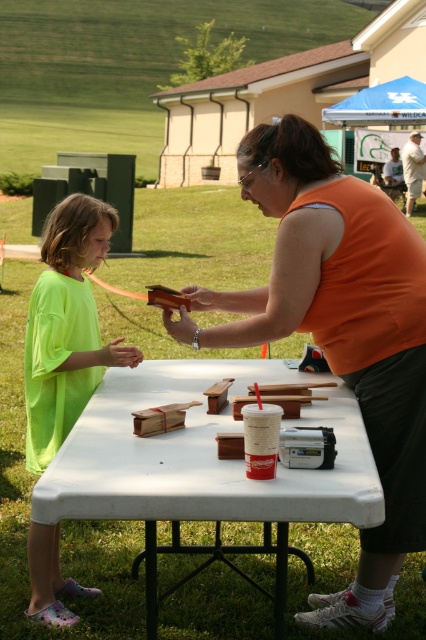
Question: Does white plastic table at center have a smaller size compared to neon green t-shirt at left?

Choices:
 (A) no
 (B) yes

Answer: (A)

Question: Can you confirm if orange fabric shirt at center is thinner than white plastic table at center?

Choices:
 (A) no
 (B) yes

Answer: (B)

Question: Which point is farther to the camera?

Choices:
 (A) orange fabric shirt at center
 (B) white plastic table at center
 (C) neon green t-shirt at left

Answer: (C)

Question: Which point is farther to the camera?

Choices:
 (A) (x=345, y=298)
 (B) (x=57, y=502)

Answer: (A)

Question: Which point is closer to the camera?

Choices:
 (A) (66, 620)
 (B) (244, 336)
 (C) (152, 452)

Answer: (C)

Question: Does orange fabric shirt at center have a smaller size compared to white plastic table at center?

Choices:
 (A) no
 (B) yes

Answer: (A)